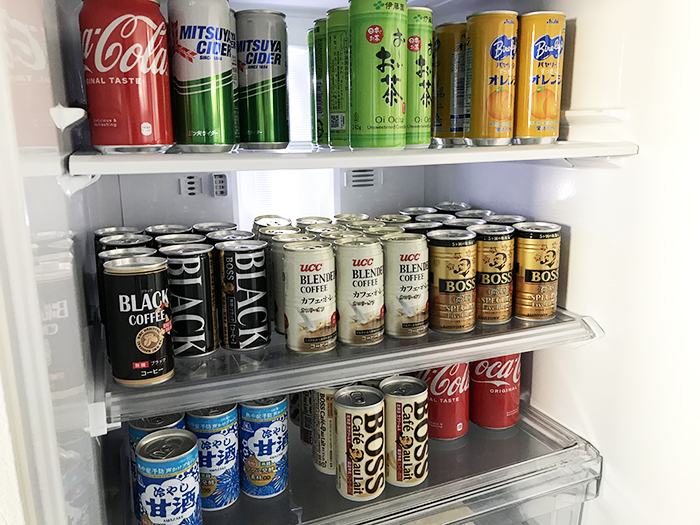
The image size is (700, 525). I want to click on drawer, so click(x=542, y=507).